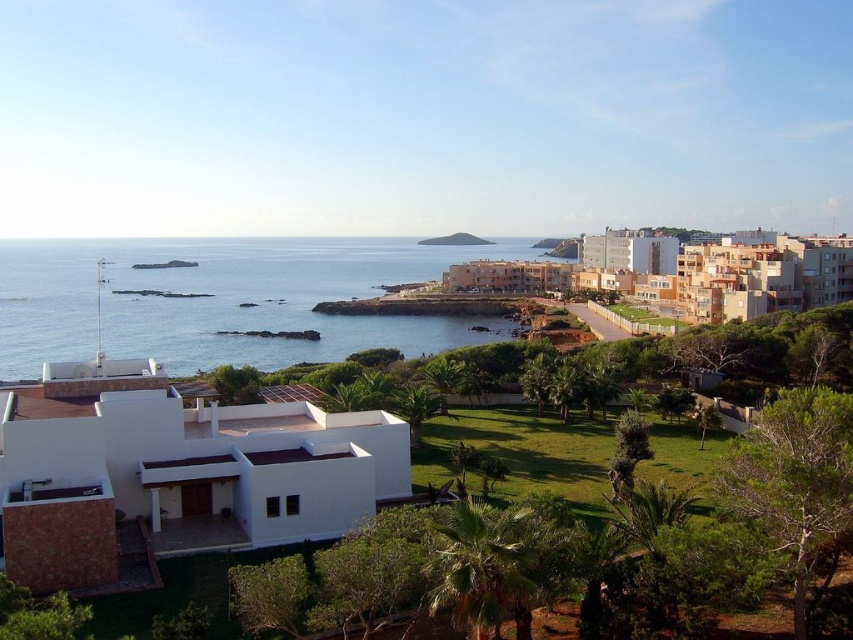
Question: Does blue water at lower left appear under green grassy hillside at center?

Choices:
 (A) yes
 (B) no

Answer: (A)

Question: Does blue water at lower left appear on the right side of green grassy hillside at center?

Choices:
 (A) no
 (B) yes

Answer: (A)

Question: Which of the following is the closest to the observer?

Choices:
 (A) green grassy hillside at center
 (B) blue water at lower left

Answer: (B)

Question: Which point is farther to the camera?

Choices:
 (A) (265, 305)
 (B) (463, 243)

Answer: (B)

Question: Is blue water at lower left above green grassy hillside at center?

Choices:
 (A) no
 (B) yes

Answer: (A)

Question: Which point is closer to the camera?

Choices:
 (A) (329, 256)
 (B) (462, 241)

Answer: (A)